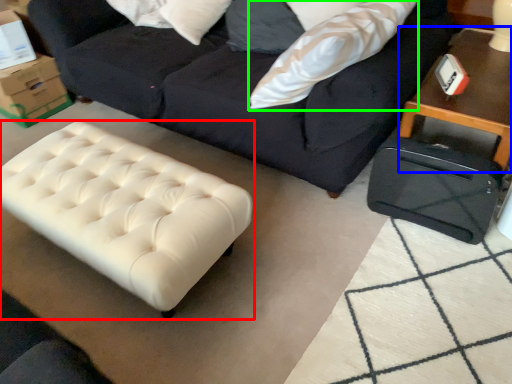
Question: Which object is positioned closest to table (highlighted by a red box)? Select from table (highlighted by a blue box) and throw pillow (highlighted by a green box).

Choices:
 (A) table
 (B) throw pillow

Answer: (B)